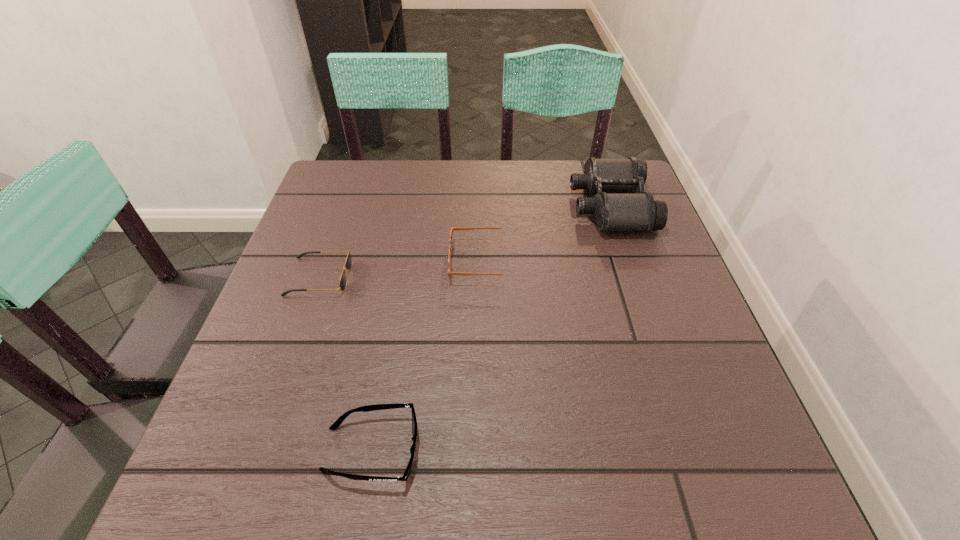
The width and height of the screenshot is (960, 540). I want to click on free spot between the binoculars and the nearest sunglasses, so [x=491, y=328].

Find the location of a particular element. The height and width of the screenshot is (540, 960). free space between the nearest object and the binoculars is located at coordinates (491, 328).

I want to click on free space between the tallest object and the leftmost object, so click(465, 241).

Locate an element on the screen. free space between the tallest sunglasses and the nearest sunglasses is located at coordinates (428, 355).

Find the location of a particular element. The height and width of the screenshot is (540, 960). vacant point located between the third object from left to right and the leftmost object is located at coordinates (401, 269).

The width and height of the screenshot is (960, 540). I want to click on free space between the tallest sunglasses and the rightmost object, so click(547, 233).

The width and height of the screenshot is (960, 540). In order to click on empty space between the rightmost sunglasses and the binoculars in this screenshot , I will do `click(547, 233)`.

In order to click on object that stands as the second closest to the leftmost sunglasses in this screenshot , I will do `click(337, 423)`.

Identify which object is the closest to the second sunglasses from right to left. Please provide its 2D coordinates. Your answer should be formatted as a tuple, i.e. [(x, y)], where the tuple contains the x and y coordinates of a point satisfying the conditions above.

[(348, 263)]

Find the location of `sunglasses that is the closest to the nearest object`. sunglasses that is the closest to the nearest object is located at coordinates (348, 263).